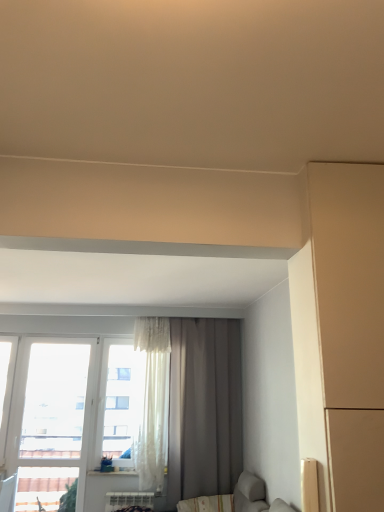
Question: From the image's perspective, does gray matte curtain at center appear higher than transparent glass window at left?

Choices:
 (A) yes
 (B) no

Answer: (A)

Question: Is gray matte curtain at center positioned beyond the bounds of transparent glass window at left?

Choices:
 (A) no
 (B) yes

Answer: (B)

Question: Are gray matte curtain at center and transparent glass window at left far apart?

Choices:
 (A) no
 (B) yes

Answer: (B)

Question: Considering the relative sizes of gray matte curtain at center and transparent glass window at left in the image provided, is gray matte curtain at center taller than transparent glass window at left?

Choices:
 (A) no
 (B) yes

Answer: (B)

Question: Does gray matte curtain at center lie in front of transparent glass window at left?

Choices:
 (A) yes
 (B) no

Answer: (A)

Question: From a real-world perspective, is gray matte curtain at center positioned over transparent glass window at left based on gravity?

Choices:
 (A) yes
 (B) no

Answer: (A)

Question: Does transparent glass window at left appear on the left side of gray matte curtain at center?

Choices:
 (A) no
 (B) yes

Answer: (B)

Question: Can you confirm if transparent glass window at left is smaller than gray matte curtain at center?

Choices:
 (A) no
 (B) yes

Answer: (B)

Question: Is transparent glass window at left at the right side of gray matte curtain at center?

Choices:
 (A) no
 (B) yes

Answer: (A)

Question: From the image's perspective, is transparent glass window at left located beneath gray matte curtain at center?

Choices:
 (A) no
 (B) yes

Answer: (B)

Question: Is transparent glass window at left oriented away from gray matte curtain at center?

Choices:
 (A) no
 (B) yes

Answer: (A)

Question: Can you confirm if transparent glass window at left is taller than gray matte curtain at center?

Choices:
 (A) no
 (B) yes

Answer: (A)

Question: In the image, is transparent glass window at left positioned in front of or behind gray matte curtain at center?

Choices:
 (A) behind
 (B) front

Answer: (A)